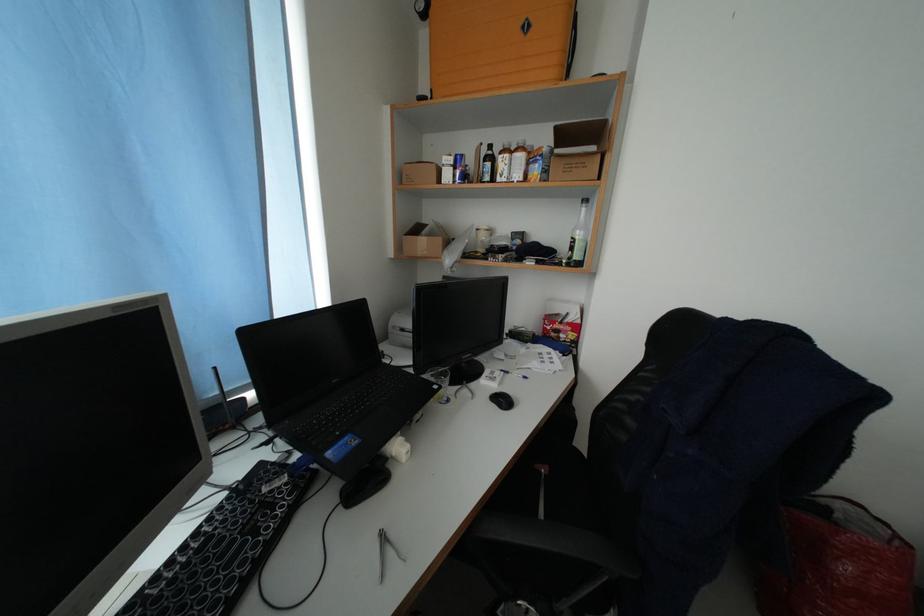
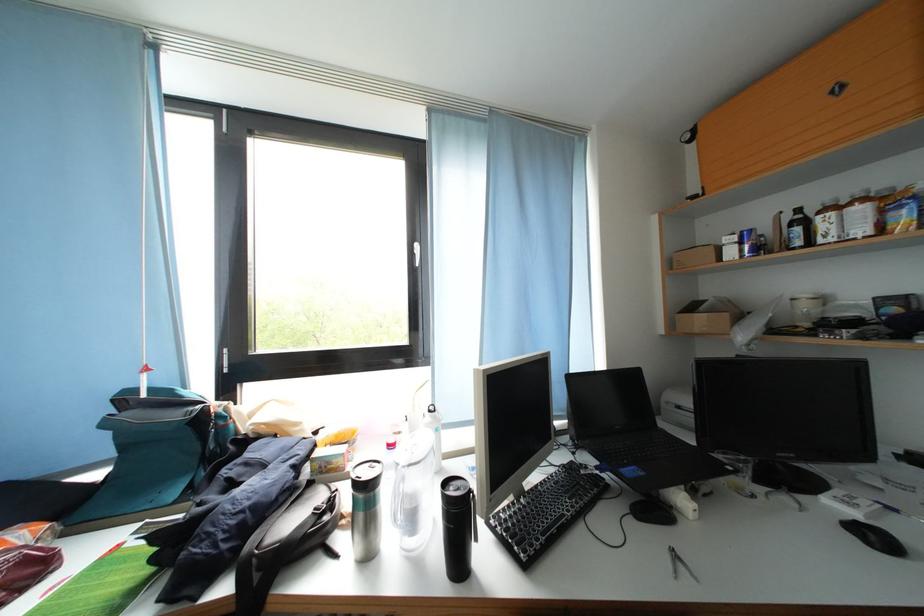
In the second image, find the point that corresponds to pixel 426 235 in the first image.

(700, 312)